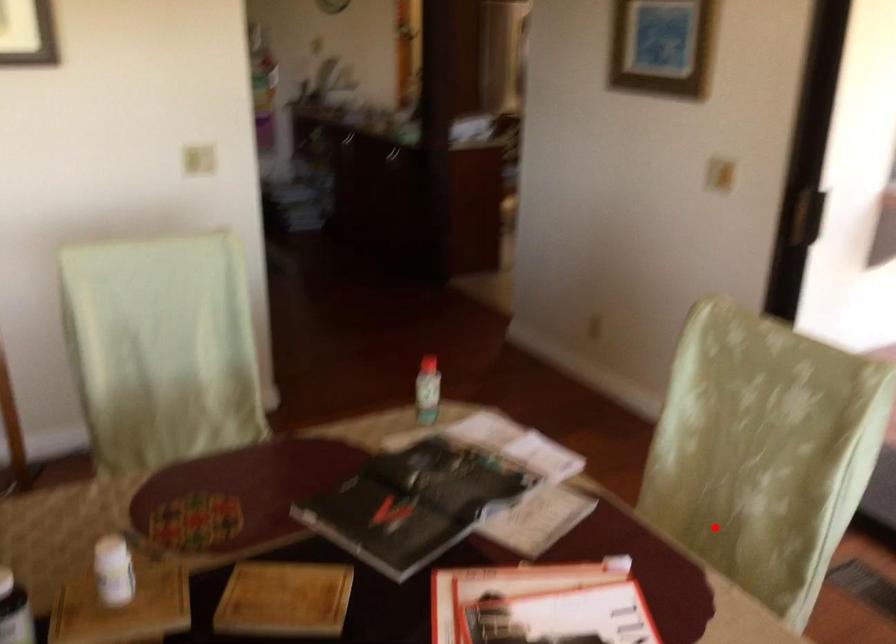
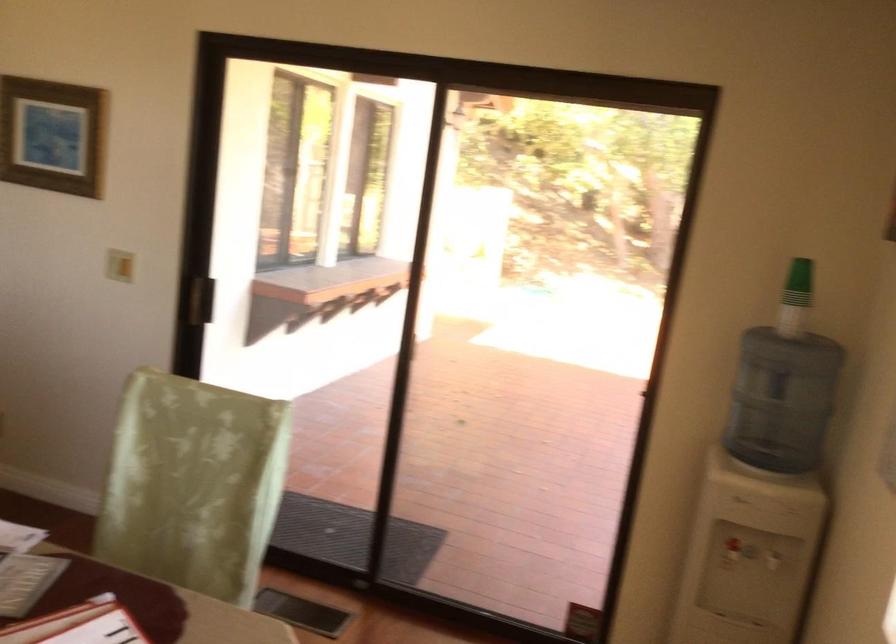
Question: I am providing you with two images of the same scene from different viewpoints. In image1, a red point is highlighted. Considering the same 3D point in image2, which of the following is correct?

Choices:
 (A) It is closer
 (B) It is farther

Answer: (B)